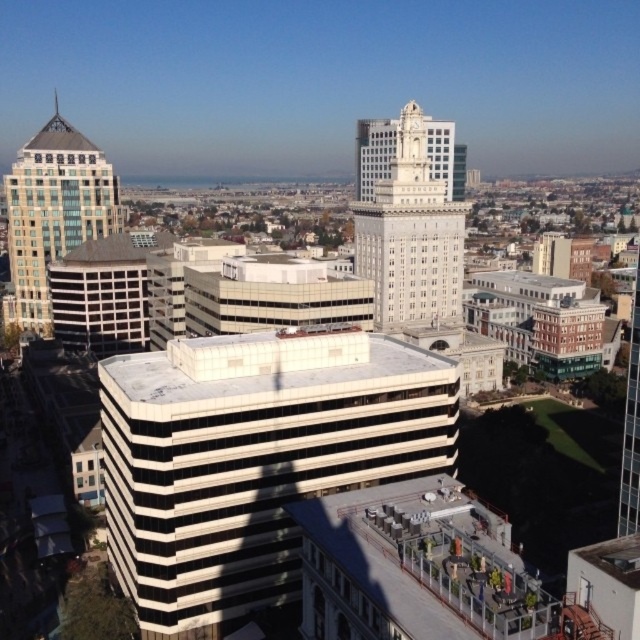
Based on the photo, which is above, white marble clock tower at center or matte glass building at upper left?

matte glass building at upper left is above.

Who is more forward, (397, 164) or (48, 156)?

Point (397, 164) is more forward.

Measure the distance between white marble clock tower at center and camera.

They are 153.80 meters apart.

Identify the location of white marble clock tower at center. (410, 230).

Can you confirm if white striped building at center is thinner than matte glass building at upper left?

Correct, white striped building at center's width is less than matte glass building at upper left's.

Is point (435, 428) positioned in front of point (52, 236)?

Yes, point (435, 428) is closer to viewer.

What do you see at coordinates (253, 458) in the screenshot? I see `white striped building at center` at bounding box center [253, 458].

Identify the location of white striped building at center. [253, 458].

Is point (166, 616) closer to camera compared to point (380, 188)?

Yes, it is.

Does point (216, 440) come farther from viewer compared to point (404, 244)?

No, it is not.

Is point (285, 534) less distant than point (417, 292)?

Yes, it is in front of point (417, 292).

What are the coordinates of `white striped building at center` in the screenshot? It's located at (253, 458).